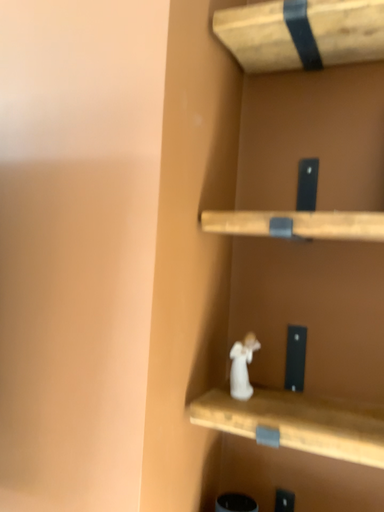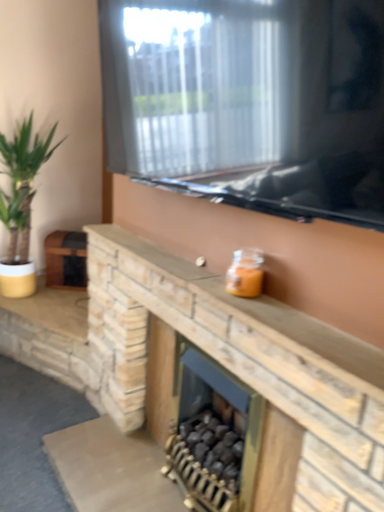
Question: How did the camera likely rotate when shooting the video?

Choices:
 (A) rotated right
 (B) rotated left

Answer: (B)